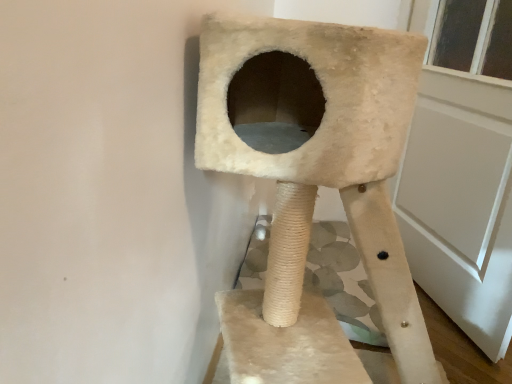
Question: Looking at their shapes, would you say white matte screen door at right is wider or thinner than beige furry cat tree at center?

Choices:
 (A) thin
 (B) wide

Answer: (A)

Question: Is white matte screen door at right taller or shorter than beige furry cat tree at center?

Choices:
 (A) tall
 (B) short

Answer: (A)

Question: From a real-world perspective, is white matte screen door at right positioned above or below beige furry cat tree at center?

Choices:
 (A) above
 (B) below

Answer: (A)

Question: In terms of height, does beige furry cat tree at center look taller or shorter compared to white matte screen door at right?

Choices:
 (A) short
 (B) tall

Answer: (A)

Question: Looking at the image, does beige furry cat tree at center seem bigger or smaller compared to white matte screen door at right?

Choices:
 (A) small
 (B) big

Answer: (B)

Question: From the image's perspective, is beige furry cat tree at center positioned above or below white matte screen door at right?

Choices:
 (A) below
 (B) above

Answer: (A)

Question: Is beige furry cat tree at center situated inside white matte screen door at right or outside?

Choices:
 (A) outside
 (B) inside

Answer: (A)